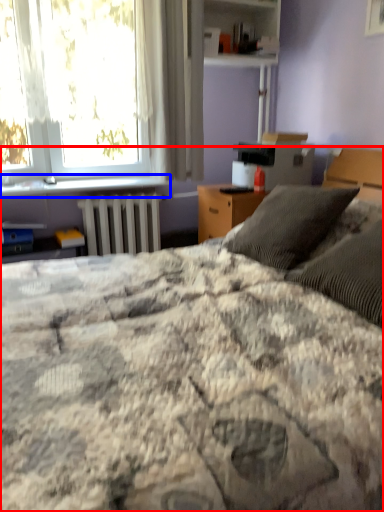
Question: Which object is further to the camera taking this photo, bed (highlighted by a red box) or window sill (highlighted by a blue box)?

Choices:
 (A) bed
 (B) window sill

Answer: (B)